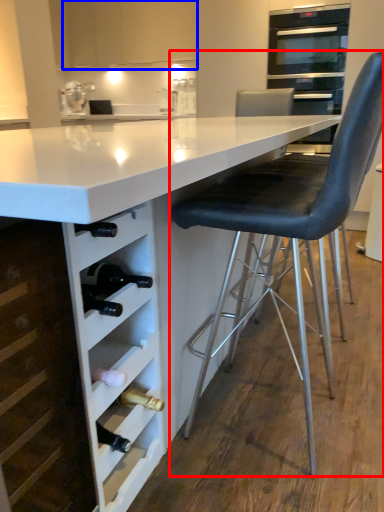
Question: Among these objects, which one is nearest to the camera, chair (highlighted by a red box) or cabinetry (highlighted by a blue box)?

Choices:
 (A) chair
 (B) cabinetry

Answer: (A)